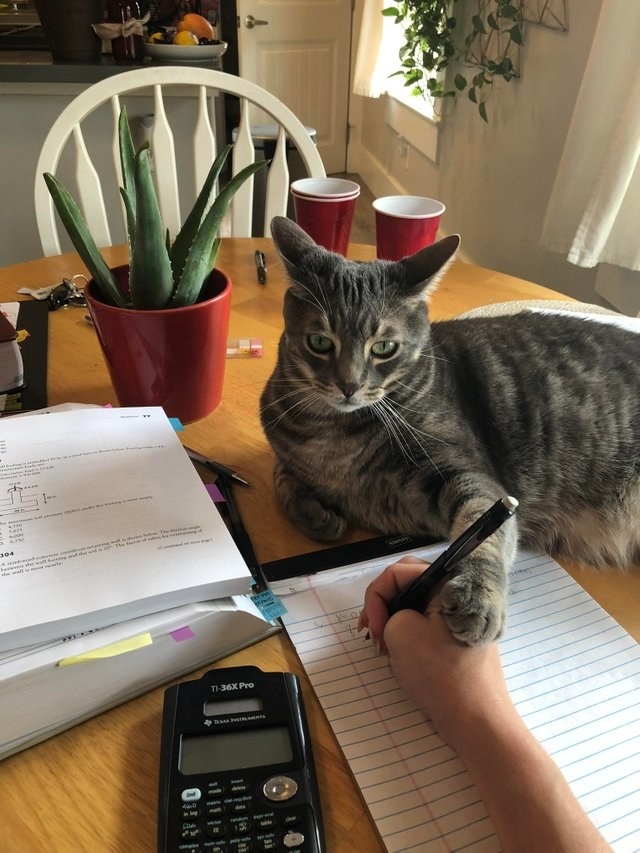
Locate an element on the screen. This screenshot has width=640, height=853. 2 cups is located at coordinates (317, 205).